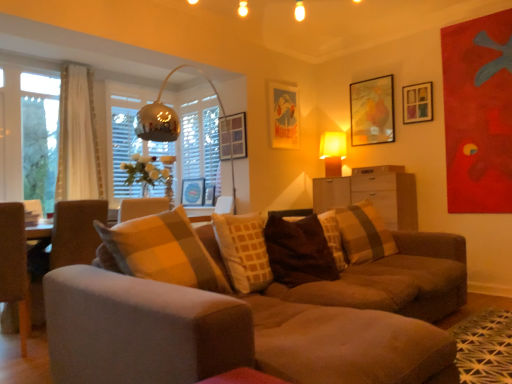
Question: From a real-world perspective, is white glossy drawer at center above or below metallic blue picture frame at center, which is the first picture frame in left-to-right order?

Choices:
 (A) above
 (B) below

Answer: (A)

Question: Is white glossy drawer at center in front of or behind metallic blue picture frame at center, which is the first picture frame in left-to-right order, in the image?

Choices:
 (A) front
 (B) behind

Answer: (A)

Question: Estimate the real-world distances between objects in this image. Which object is farther from the transparent glass door at left?

Choices:
 (A) white sheer curtain at left
 (B) matte paper picture frame at upper center, which is the fourth picture frame in left-to-right order
 (C) suede couch at center
 (D) matte brown dresser at center
 (E) matte wooden picture frame at center, which is the 2th picture frame in left-to-right order

Answer: (D)

Question: Estimate the real-world distances between objects in this image. Which object is farther from the gray fabric swivel chair at left?

Choices:
 (A) transparent glass door at left
 (B) metallic blue picture frame at center, which is the 6th picture frame in right-to-left order
 (C) white sheer curtain at left
 (D) plaid fabric pillow at center, marked as the first pillow in a back-to-front arrangement
 (E) yellow fabric lampshade at upper right

Answer: (B)